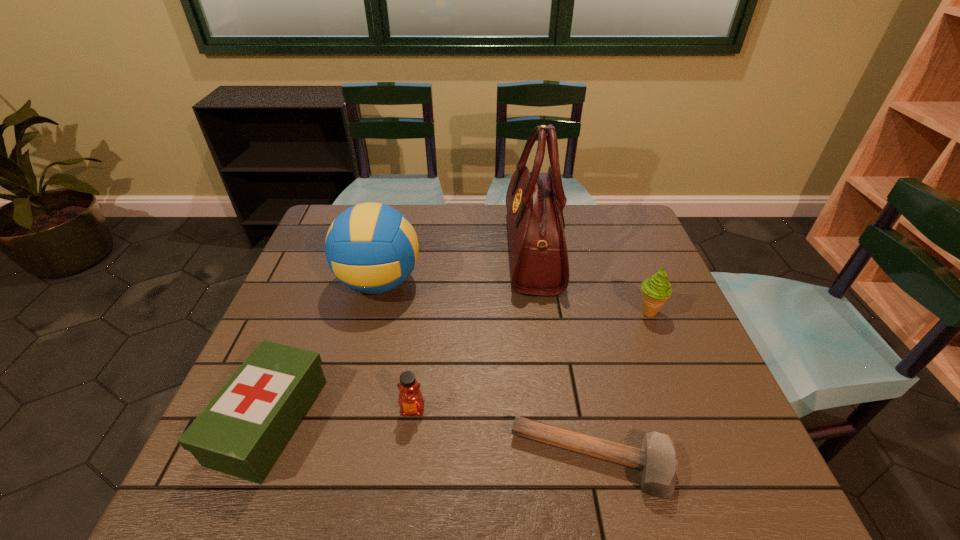
Find the location of a particular element. The image size is (960, 540). vacant space that is in between the honey and the first-aid kit is located at coordinates (341, 415).

Where is `vacant space that is in between the volleyball and the shortest object`? Image resolution: width=960 pixels, height=540 pixels. vacant space that is in between the volleyball and the shortest object is located at coordinates (486, 371).

Find the location of a particular element. vacant region between the icecream and the second tallest object is located at coordinates (514, 297).

You are a GUI agent. You are given a task and a screenshot of the screen. Output one action in this format:
    pyautogui.click(x=<x>, y=<y>)
    Task: Click on the vacant space that is in between the tallest object and the first-aid kit
    
    Given the screenshot: What is the action you would take?
    pyautogui.click(x=401, y=336)

At what (x,y) coordinates should I click in order to perform the action: click on vacant area that lies between the honey and the shortest object. Please return your answer as a coordinate pair (x, y). Looking at the image, I should click on (502, 435).

This screenshot has height=540, width=960. Identify the location of free space between the handbag and the mallet. (563, 355).

The image size is (960, 540). Find the location of `free space between the first-aid kit and the honey`. free space between the first-aid kit and the honey is located at coordinates (341, 415).

I want to click on the second closest object to the second tallest object, so click(539, 259).

Select which object appears as the second closest to the tallest object. Please provide its 2D coordinates. Your answer should be formatted as a tuple, i.e. [(x, y)], where the tuple contains the x and y coordinates of a point satisfying the conditions above.

[(372, 248)]

Where is `free location that satisfies the following two spatial constraints: 1. on the front-facing side of the tallest object; 2. on the left side of the fourth shortest object`? free location that satisfies the following two spatial constraints: 1. on the front-facing side of the tallest object; 2. on the left side of the fourth shortest object is located at coordinates (541, 312).